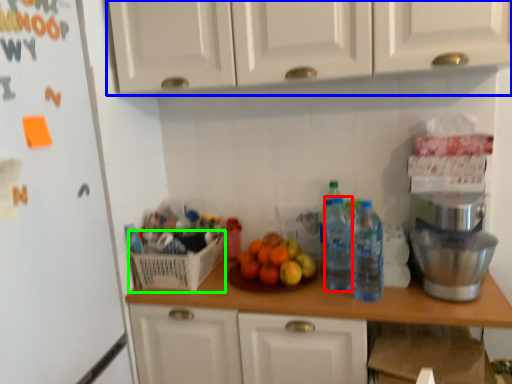
Question: Which is nearer to the bottle (highlighted by a red box)? cabinetry (highlighted by a blue box) or basket (highlighted by a green box).

Choices:
 (A) cabinetry
 (B) basket

Answer: (B)